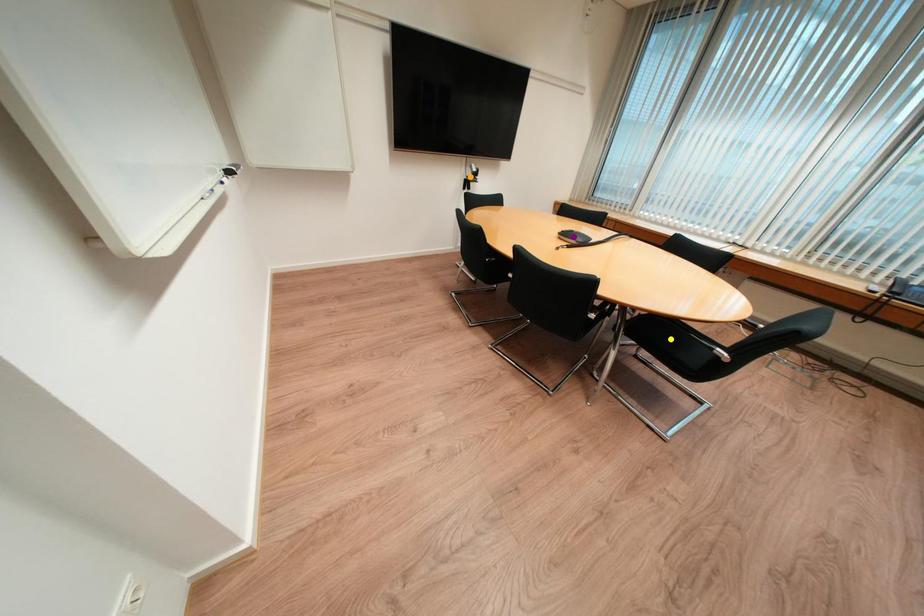
Order these from nearest to farthest:
- yellow point
- orange point
- purple point

1. orange point
2. purple point
3. yellow point